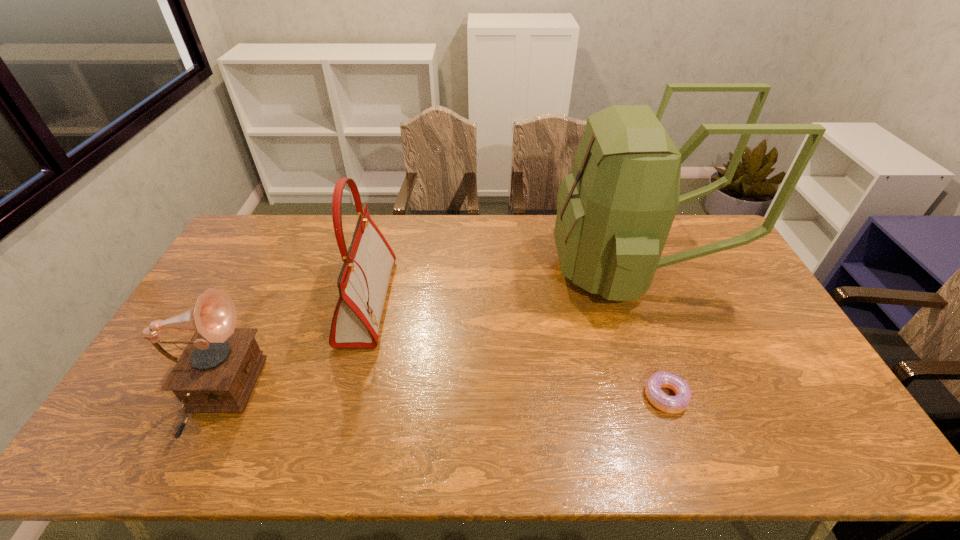
In order to click on the tallest object in this screenshot , I will do `click(615, 210)`.

You are a GUI agent. You are given a task and a screenshot of the screen. Output one action in this format:
    pyautogui.click(x=<x>, y=<y>)
    Task: Click on the third shortest object
    This screenshot has height=540, width=960.
    Given the screenshot: What is the action you would take?
    pyautogui.click(x=363, y=280)

What are the coordinates of `handbag` in the screenshot? It's located at (363, 280).

Where is `record player`? The image size is (960, 540). record player is located at coordinates (216, 373).

The width and height of the screenshot is (960, 540). Identify the location of the second shortest object. (216, 373).

Image resolution: width=960 pixels, height=540 pixels. Identify the location of the shortest object. (676, 404).

Find the location of `free space located 0.110m on the front pocket of the backpack`. free space located 0.110m on the front pocket of the backpack is located at coordinates tap(520, 269).

The image size is (960, 540). I want to click on vacant space located 0.100m on the front pocket of the backpack, so click(x=524, y=269).

This screenshot has width=960, height=540. What are the coordinates of `blank area located on the front pocket of the backpack` in the screenshot? It's located at (530, 269).

I want to click on blank space located 0.080m on the front of the handbag, so click(x=348, y=374).